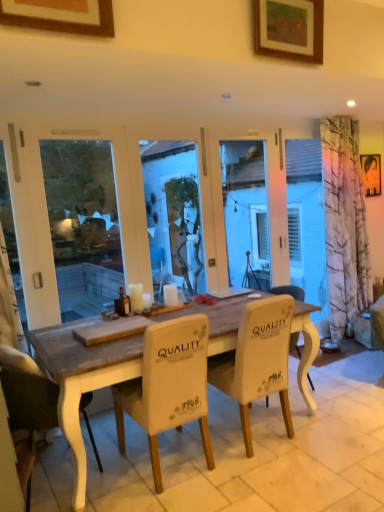
The image size is (384, 512). I want to click on vacant region below wooden picture frame at upper center, arranged as the 2th picture frame when viewed from the front (from a real-world perspective), so click(305, 451).